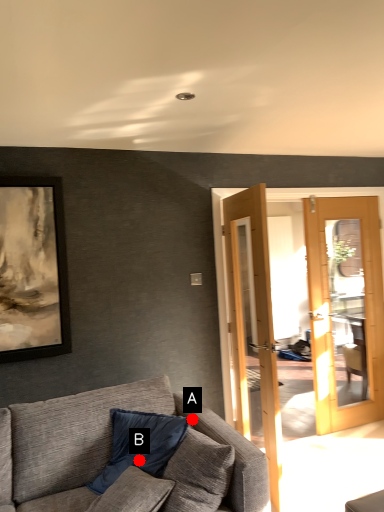
Question: Two points are circled on the image, labeled by A and B beside each circle. Which point appears closest to the camera in this image?

Choices:
 (A) A is closer
 (B) B is closer

Answer: (B)